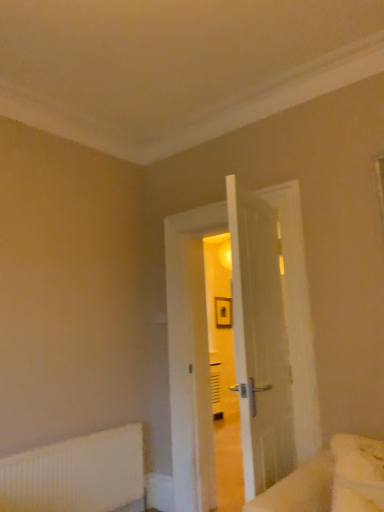
Question: Is white ribbed radiator at lower left bigger or smaller than white wooden door at center?

Choices:
 (A) small
 (B) big

Answer: (A)

Question: Considering the positions of white ribbed radiator at lower left and white wooden door at center in the image, is white ribbed radiator at lower left wider or thinner than white wooden door at center?

Choices:
 (A) thin
 (B) wide

Answer: (A)

Question: Which object is positioned closest to the white wooden door at center?

Choices:
 (A) white ribbed radiator at lower left
 (B) white fluffy bed at lower right

Answer: (A)

Question: Considering the real-world distances, which object is farthest from the white ribbed radiator at lower left?

Choices:
 (A) white fluffy bed at lower right
 (B) white wooden door at center

Answer: (A)